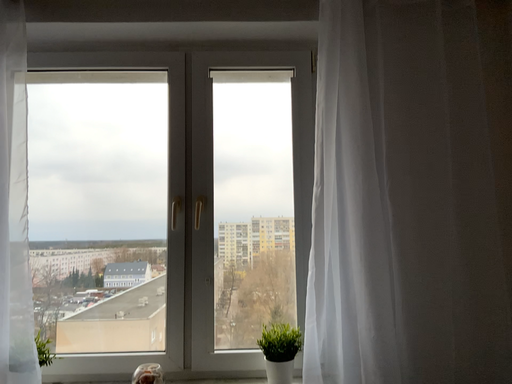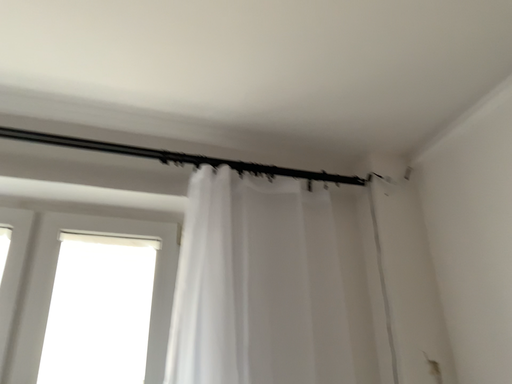
Question: Which way did the camera rotate in the video?

Choices:
 (A) rotated downward
 (B) rotated upward

Answer: (B)